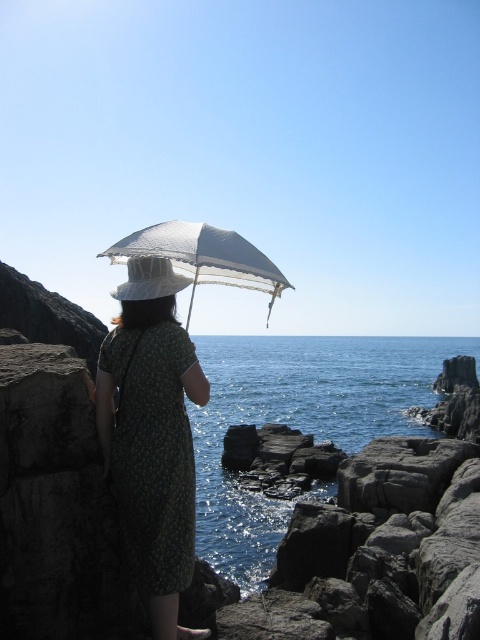
You are a photographer trying to capture the scene of the person with their back to the camera. You need to ensure both the green floral dress at left and the white lace umbrella at center are visible in the frame. Based on their positions, which object is closer to the center of the image?

The white lace umbrella at center is positioned at the center of the image, while the green floral dress at left is on its right side. Therefore, the white lace umbrella at center is closer to the center.

You are a photographer trying to capture the scene with a camera. The green floral dress at left and the white lace umbrella at center are both in your shot. If you want to ensure both objects are fully visible without cropping, which object should you adjust your camera angle to focus on first?

The green floral dress at left has a smaller width than the white lace umbrella at center, so you should focus on the wider white lace umbrella at center first to ensure it fits within the frame before adjusting for the narrower green floral dress at left.

You are a photographer trying to capture the perfect shot of the green floral dress at left in the coastal scene. If you want to position the dress exactly at the center of your camera frame, which direction should you move the camera? Please provide your answer based on the coordinates provided in the scene description.

The green floral dress at left is located at coordinates point (x=153, y=452). To center it in the camera frame, you should move the camera to the right and upwards since the dress is currently positioned to the left and below the center.